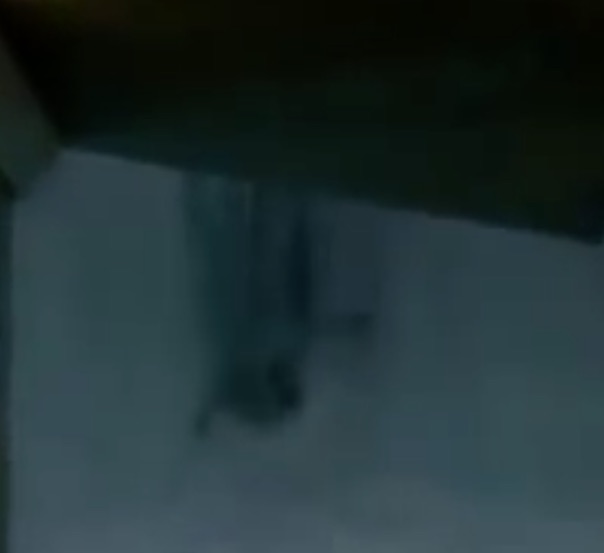
At what (x,y) coordinates should I click in order to perform the action: click on wall. Please return your answer as a coordinate pair (x, y). Looking at the image, I should click on (34, 155).